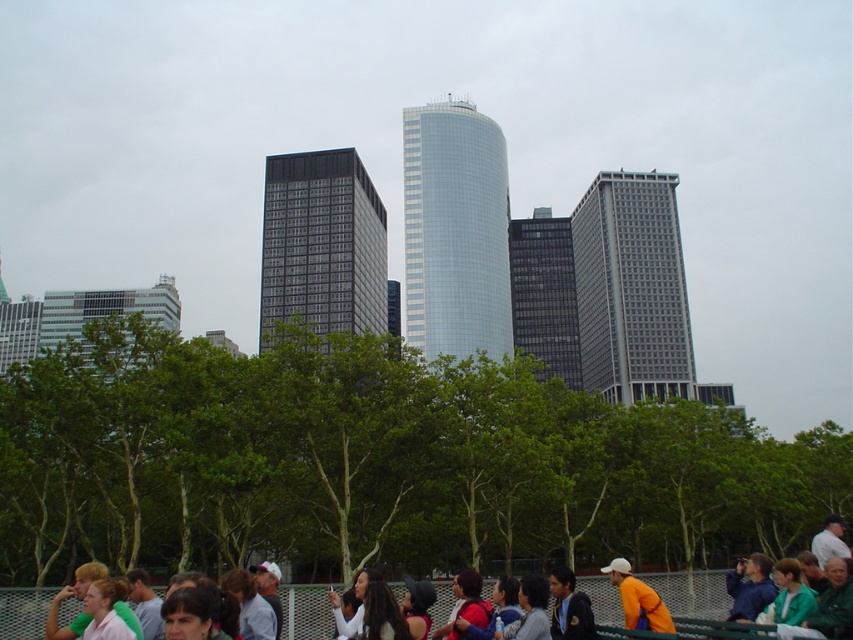
You are a city planner analyzing the urban layout. You need to determine which building, the shiny glass skyscraper at center or the dark gray glass building at center, has a greater height for potential antenna installation. Which one should you choose?

The shiny glass skyscraper at center is much taller than the dark gray glass building at center, so you should choose the shiny glass skyscraper at center for antenna installation.

You are an architect analyzing the urban scene. You notice two skyscrapers in the image. Which one is wider, the shiny glass skyscraper at center or the gray glass skyscraper at center?

The shiny glass skyscraper at center might be wider than gray glass skyscraper at center according to the description provided.

You are standing in the urban scene described. You want to take a photo of the shiny glass skyscraper at center. Considering your position relative to the skyscraper, is the distance sufficient to capture the entire building in a single frame using a standard smartphone camera with a 24mm lens? Please explain your reasoning.

The distance between you and the shiny glass skyscraper at center is 116.79 meters. A standard smartphone camera with a 24mm lens has a field of view that can typically capture objects at this distance within a single frame, so yes, you should be able to capture the entire building in one photo.